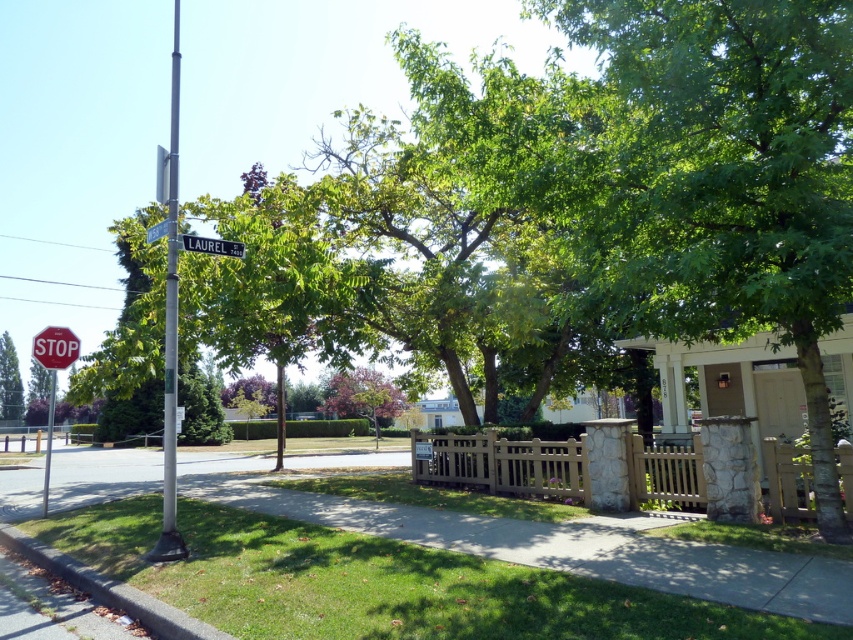
Question: Can you confirm if silver metallic pole at left is positioned to the right of green leafy tree at left?

Choices:
 (A) yes
 (B) no

Answer: (A)

Question: Does gray concrete curb at lower left appear on the right side of pinkish-red bark tree at center?

Choices:
 (A) yes
 (B) no

Answer: (A)

Question: Based on their relative distances, which object is nearer to the green grass at lower left?

Choices:
 (A) pinkish-red bark tree at center
 (B) metallic silver street sign at upper center

Answer: (B)

Question: Which object appears farthest from the camera in this image?

Choices:
 (A) pinkish-red bark tree at center
 (B) green grass at lower left
 (C) metal street sign at upper center
 (D) metallic pole at left

Answer: (A)

Question: Is green grass at lower left to the left of metallic pole at left from the viewer's perspective?

Choices:
 (A) no
 (B) yes

Answer: (A)

Question: Among these objects, which one is farthest from the camera?

Choices:
 (A) metallic silver street sign at upper center
 (B) green leafy tree at left
 (C) gray concrete curb at lower left

Answer: (B)